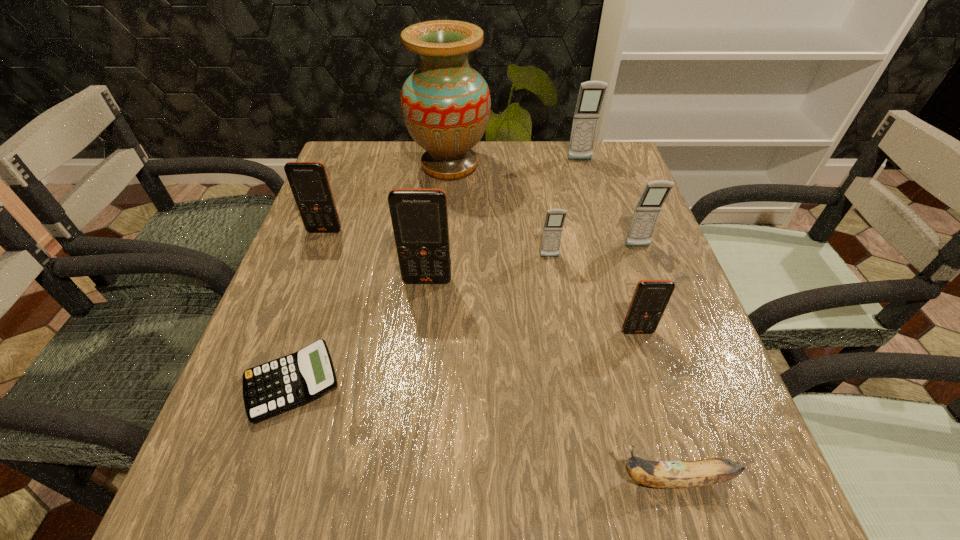
Find the location of a particular element. This screenshot has height=540, width=960. the eighth closest object to the smallest gray cellular telephone is located at coordinates (309, 183).

Locate an element on the screen. cellular telephone that stands as the closest to the fourth cellular telephone from right to left is located at coordinates (647, 211).

Where is `cellular telephone object that ranks as the closest to the fourth nearest cellular telephone`? The height and width of the screenshot is (540, 960). cellular telephone object that ranks as the closest to the fourth nearest cellular telephone is located at coordinates (552, 232).

What are the coordinates of `gray cellular telephone object that ranks as the closest to the biggest gray cellular telephone` in the screenshot? It's located at (647, 211).

The image size is (960, 540). I want to click on gray cellular telephone that is the second closest one to the calculator, so click(647, 211).

Locate an element on the screen. The width and height of the screenshot is (960, 540). orange cellular telephone that can be found as the closest to the second smallest orange cellular telephone is located at coordinates (419, 217).

In order to click on orange cellular telephone that is the second closest to the third nearest object in this screenshot , I will do `click(309, 183)`.

Where is `blank area in the image that satisfies the following two spatial constraints: 1. on the screen of the nearest orange cellular telephone; 2. on the peel of the yellow banana`? blank area in the image that satisfies the following two spatial constraints: 1. on the screen of the nearest orange cellular telephone; 2. on the peel of the yellow banana is located at coordinates (683, 480).